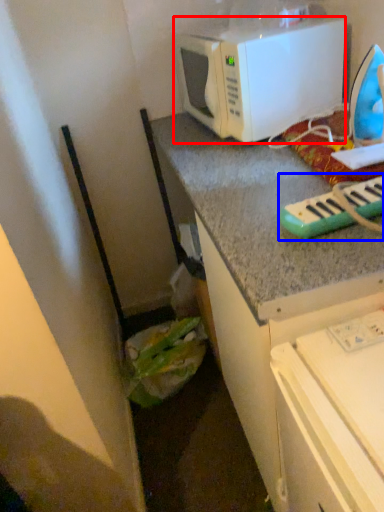
Question: Which object is closer to the camera taking this photo, microwave oven (highlighted by a red box) or musical keyboard (highlighted by a blue box)?

Choices:
 (A) microwave oven
 (B) musical keyboard

Answer: (B)